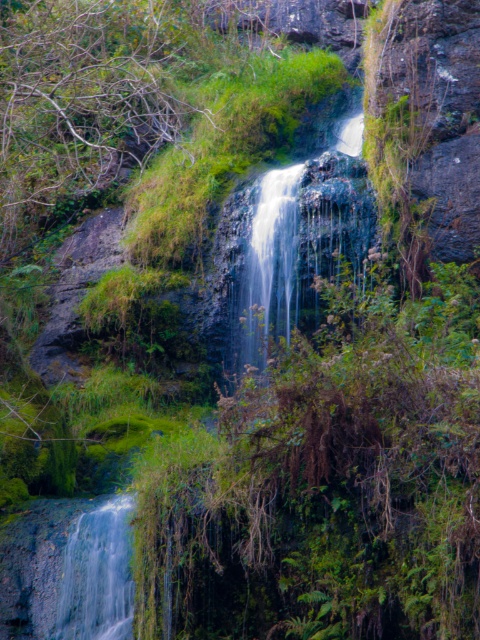
Does point (288, 188) lie in front of point (62, 596)?

No, it is behind (62, 596).

Who is taller, translucent glass waterfall at center or clear water at bottom left?

translucent glass waterfall at center

Between point (260, 285) and point (118, 500), which one is positioned behind?

Point (260, 285)

Image resolution: width=480 pixels, height=640 pixels. I want to click on translucent glass waterfall at center, so click(x=286, y=248).